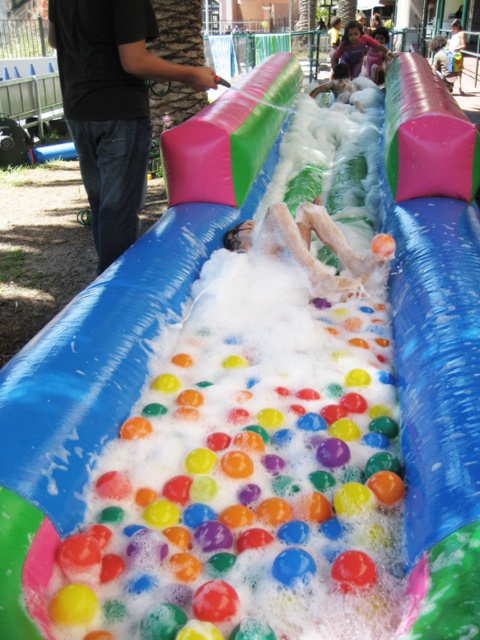
How distant is black jeans at left from smooth skin child at center?

A distance of 11.41 feet exists between black jeans at left and smooth skin child at center.

Can you confirm if black jeans at left is shorter than smooth skin child at center?

Incorrect, black jeans at left's height does not fall short of smooth skin child at center's.

Does point (121, 67) lie behind point (336, 76)?

No, it is in front of (336, 76).

Locate an element on the screen. black jeans at left is located at coordinates (111, 106).

Is point (132, 35) more distant than point (335, 74)?

No, it is in front of (335, 74).

Is black jeans at left above smooth skin girl at upper center?

No.

Does point (117, 88) lie in front of point (351, 61)?

Yes, it is.

Identify the location of black jeans at left. The height and width of the screenshot is (640, 480). (111, 106).

Does smooth skin girl at upper center have a lesser width compared to smooth skin child at center?

Incorrect, smooth skin girl at upper center's width is not less than smooth skin child at center's.

From the picture: Which of these two, smooth skin girl at upper center or smooth skin child at center, stands shorter?

With less height is smooth skin child at center.

Who is more distant from viewer, (359, 33) or (344, 83)?

The point (359, 33) is more distant.

Locate an element on the screen. This screenshot has width=480, height=640. smooth skin girl at upper center is located at coordinates (354, 49).